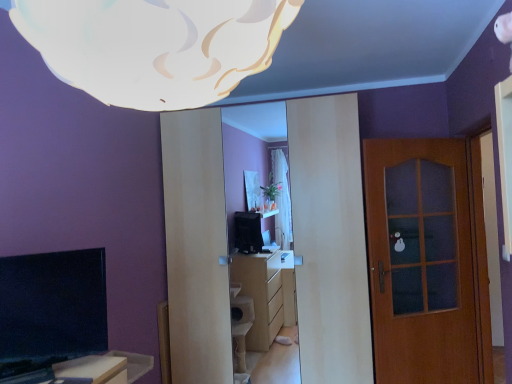
Question: In the image, is brown wooden door at right positioned in front of or behind white matte cloud at upper center?

Choices:
 (A) behind
 (B) front

Answer: (A)

Question: Visually, is brown wooden door at right positioned to the left or to the right of white matte cloud at upper center?

Choices:
 (A) right
 (B) left

Answer: (A)

Question: Based on their sizes in the image, would you say brown wooden door at right is bigger or smaller than white matte cloud at upper center?

Choices:
 (A) small
 (B) big

Answer: (B)

Question: Considering their positions, is white matte cloud at upper center located in front of or behind brown wooden door at right?

Choices:
 (A) front
 (B) behind

Answer: (A)

Question: Is point (202, 102) positioned closer to the camera than point (446, 364)?

Choices:
 (A) closer
 (B) farther

Answer: (A)

Question: Based on their positions, is white matte cloud at upper center located to the left or right of brown wooden door at right?

Choices:
 (A) right
 (B) left

Answer: (B)

Question: From the image's perspective, is white matte cloud at upper center positioned above or below brown wooden door at right?

Choices:
 (A) above
 (B) below

Answer: (A)